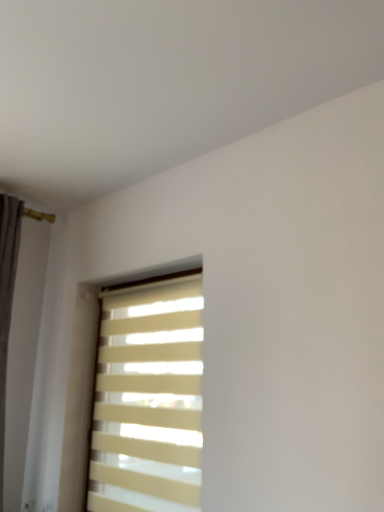
Question: Is white matte shutter at left to the left or to the right of beige fabric blinds at center in the image?

Choices:
 (A) left
 (B) right

Answer: (A)

Question: Is white matte shutter at left taller or shorter than beige fabric blinds at center?

Choices:
 (A) tall
 (B) short

Answer: (A)

Question: From the image's perspective, is white matte shutter at left above or below beige fabric blinds at center?

Choices:
 (A) above
 (B) below

Answer: (A)

Question: Looking at the image, does beige fabric blinds at center seem bigger or smaller compared to white matte shutter at left?

Choices:
 (A) small
 (B) big

Answer: (A)

Question: Looking at their shapes, would you say beige fabric blinds at center is wider or thinner than white matte shutter at left?

Choices:
 (A) thin
 (B) wide

Answer: (B)

Question: In terms of height, does beige fabric blinds at center look taller or shorter compared to white matte shutter at left?

Choices:
 (A) tall
 (B) short

Answer: (B)

Question: From a real-world perspective, is beige fabric blinds at center above or below white matte shutter at left?

Choices:
 (A) below
 (B) above

Answer: (A)